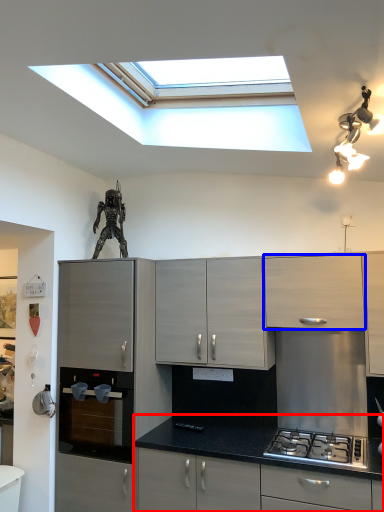
Question: Among these objects, which one is nearest to the camera, cabinetry (highlighted by a red box) or cabinetry (highlighted by a blue box)?

Choices:
 (A) cabinetry
 (B) cabinetry

Answer: (A)